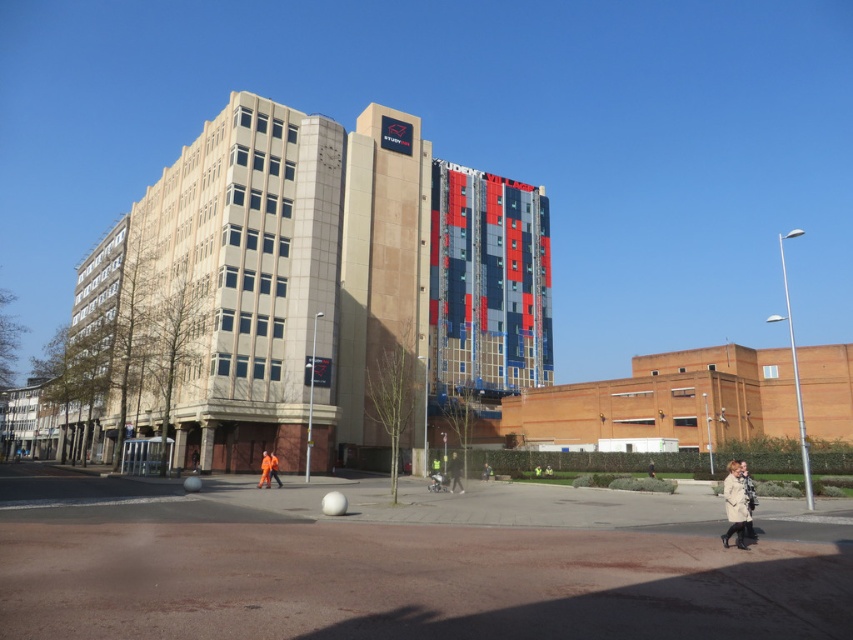
Question: Can you confirm if orange fabric person at center is wider than orange workwear at center?

Choices:
 (A) yes
 (B) no

Answer: (A)

Question: Does yellow reflective vest at center appear under orange fabric person at center?

Choices:
 (A) no
 (B) yes

Answer: (B)

Question: Estimate the real-world distances between objects in this image. Which object is farther from the orange fabric person at center?

Choices:
 (A) yellow reflective vest at center
 (B) orange workwear at center

Answer: (A)

Question: Can you confirm if yellow reflective vest at center is wider than orange fabric person at center?

Choices:
 (A) yes
 (B) no

Answer: (B)

Question: Which object is farther from the camera taking this photo?

Choices:
 (A) orange fabric person at center
 (B) yellow reflective vest at center

Answer: (B)

Question: Which point is farther from the camera taking this photo?

Choices:
 (A) (448, 460)
 (B) (263, 464)

Answer: (A)